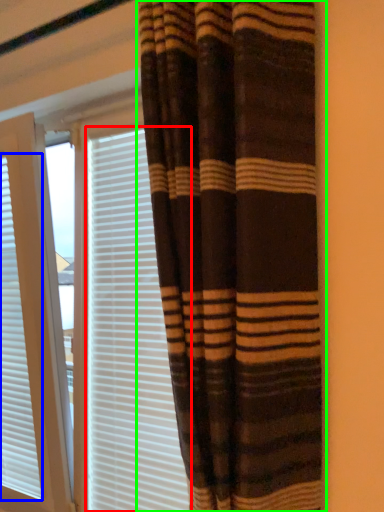
Question: Considering the real-world distances, which object is farthest from blind (highlighted by a red box)? window blind (highlighted by a blue box) or curtain (highlighted by a green box)?

Choices:
 (A) window blind
 (B) curtain

Answer: (B)